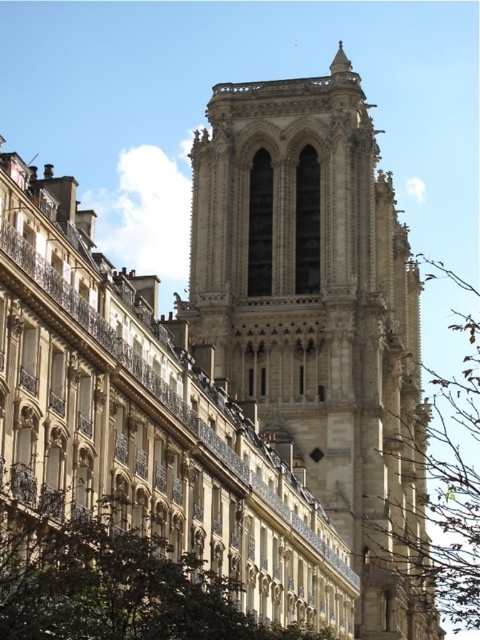
Can you confirm if beige stone tower at center is positioned to the right of green leafy tree at lower left?

Indeed, beige stone tower at center is positioned on the right side of green leafy tree at lower left.

Can you confirm if beige stone tower at center is wider than green leafy tree at lower left?

Indeed, beige stone tower at center has a greater width compared to green leafy tree at lower left.

The image size is (480, 640). I want to click on beige stone tower at center, so click(x=319, y=316).

Does green leafy tree at lower left have a lesser width compared to brown leafy tree at right?

Indeed, green leafy tree at lower left has a lesser width compared to brown leafy tree at right.

Who is taller, green leafy tree at lower left or brown leafy tree at right?

brown leafy tree at right is taller.

Where is `green leafy tree at lower left`? Image resolution: width=480 pixels, height=640 pixels. green leafy tree at lower left is located at coordinates (115, 582).

Find the location of `green leafy tree at lower left`. green leafy tree at lower left is located at coordinates (115, 582).

Between beige stone tower at center and brown leafy tree at right, which one is positioned lower?

brown leafy tree at right

Can you confirm if beige stone tower at center is taller than brown leafy tree at right?

No, beige stone tower at center is not taller than brown leafy tree at right.

The height and width of the screenshot is (640, 480). Find the location of `beige stone tower at center`. beige stone tower at center is located at coordinates (319, 316).